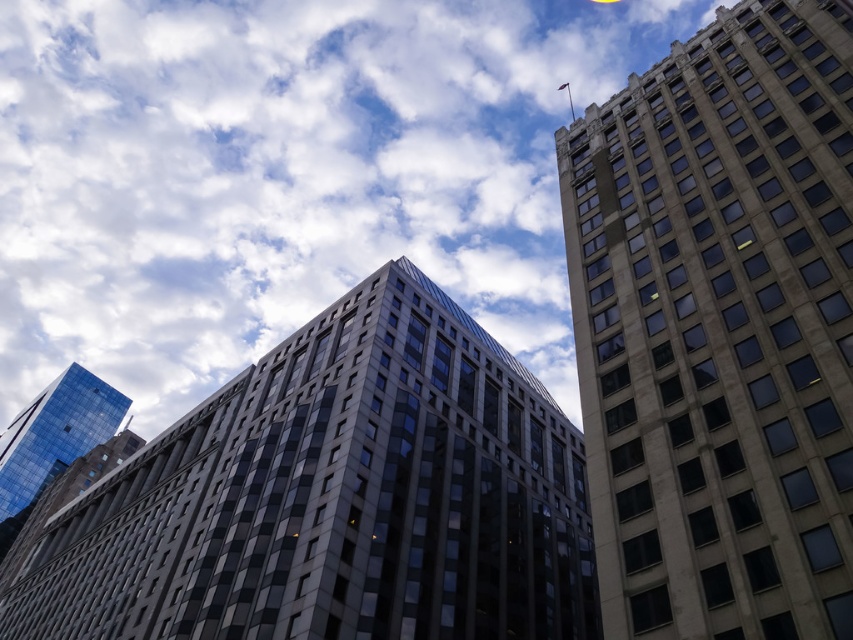
Can you confirm if beige stone tower at right is wider than shiny glass skyscraper at lower left?

No, beige stone tower at right is not wider than shiny glass skyscraper at lower left.

Is beige stone tower at right taller than shiny glass skyscraper at lower left?

Yes.

The width and height of the screenshot is (853, 640). What do you see at coordinates (718, 328) in the screenshot?
I see `beige stone tower at right` at bounding box center [718, 328].

Where is `beige stone tower at right`? beige stone tower at right is located at coordinates (718, 328).

Can you confirm if white fluffy cloud at upper center is thinner than matte glass building at center?

No, white fluffy cloud at upper center is not thinner than matte glass building at center.

At what (x,y) coordinates should I click in order to perform the action: click on white fluffy cloud at upper center. Please return your answer as a coordinate pair (x, y). The height and width of the screenshot is (640, 853). Looking at the image, I should click on (285, 173).

Find the location of `white fluffy cloud at upper center`. white fluffy cloud at upper center is located at coordinates (285, 173).

Who is more distant from viewer, (x=242, y=42) or (x=805, y=144)?

The point (x=242, y=42) is more distant.

Does white fluffy cloud at upper center appear under beige stone tower at right?

No, white fluffy cloud at upper center is not below beige stone tower at right.

At what (x,y) coordinates should I click in order to perform the action: click on white fluffy cloud at upper center. Please return your answer as a coordinate pair (x, y). The height and width of the screenshot is (640, 853). Looking at the image, I should click on (285, 173).

At what (x,y) coordinates should I click in order to perform the action: click on white fluffy cloud at upper center. Please return your answer as a coordinate pair (x, y). The height and width of the screenshot is (640, 853). Looking at the image, I should click on (285, 173).